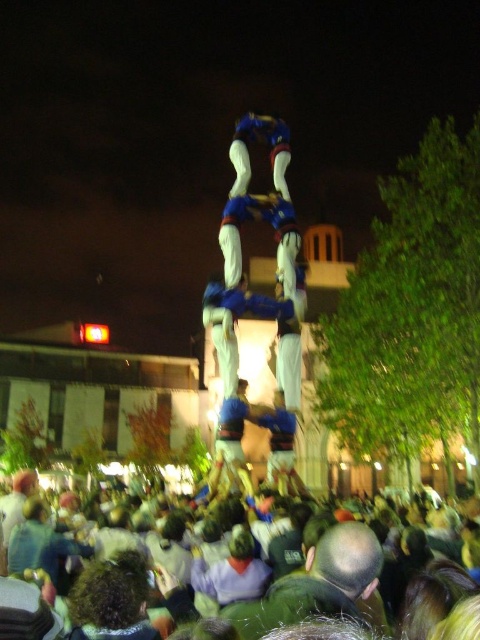
Question: Does blue fabric human at center have a lesser width compared to blue fabric pants at center?

Choices:
 (A) yes
 (B) no

Answer: (B)

Question: Which of these objects is positioned farthest from the blue fabric human at center?

Choices:
 (A) blue fabric pants at center
 (B) dark green fabric crowd at lower center

Answer: (B)

Question: Can you confirm if dark green fabric crowd at lower center is positioned to the left of blue fabric pants at center?

Choices:
 (A) yes
 (B) no

Answer: (A)

Question: Among these points, which one is farthest from the camera?

Choices:
 (A) (110, 637)
 (B) (277, 296)
 (C) (237, 186)

Answer: (C)

Question: Does dark green fabric crowd at lower center appear over blue fabric pants at center?

Choices:
 (A) no
 (B) yes

Answer: (A)

Question: Estimate the real-world distances between objects in this image. Which object is closer to the blue fabric pants at center?

Choices:
 (A) dark green fabric crowd at lower center
 (B) blue fabric human at center

Answer: (B)